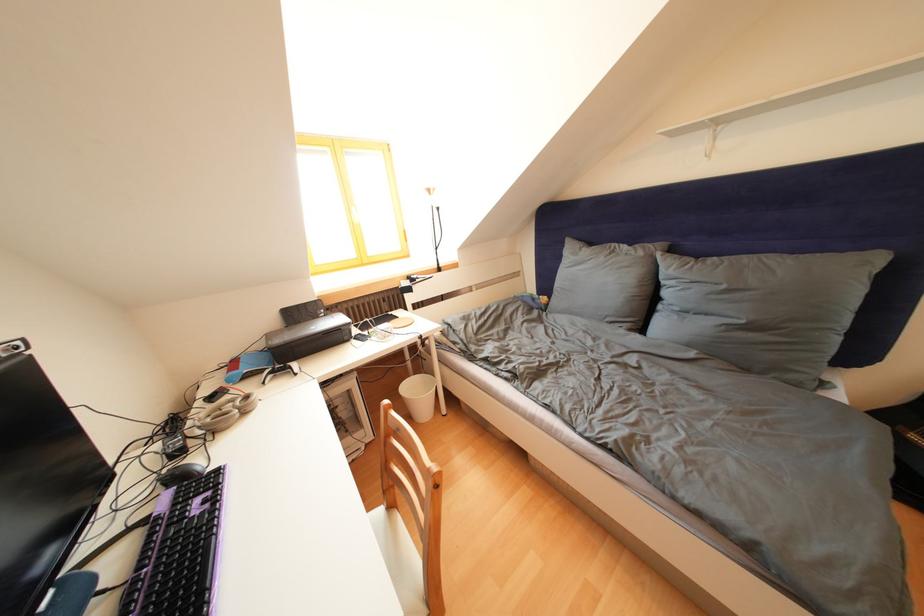
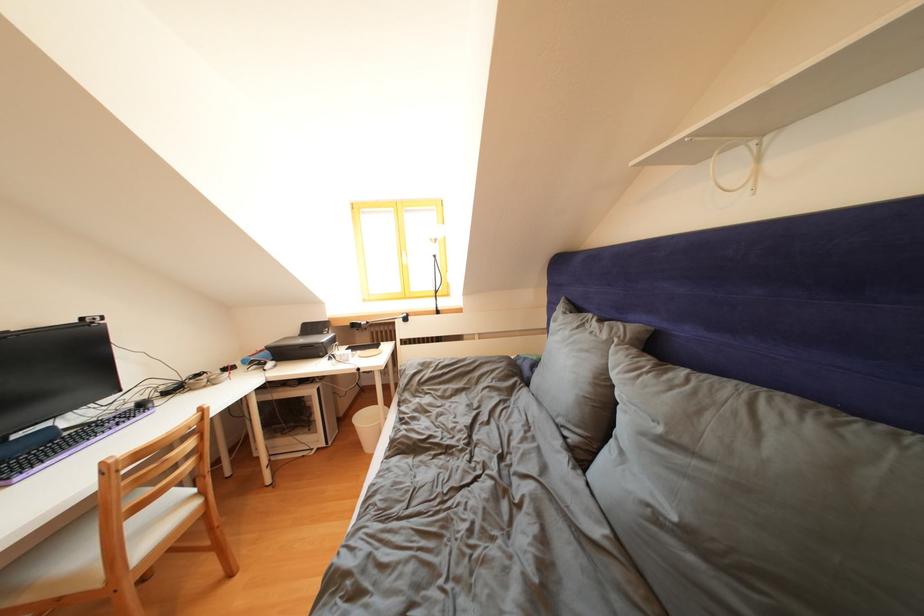
In the second image, find the point that corresponds to point 649,259 in the first image.

(612, 341)